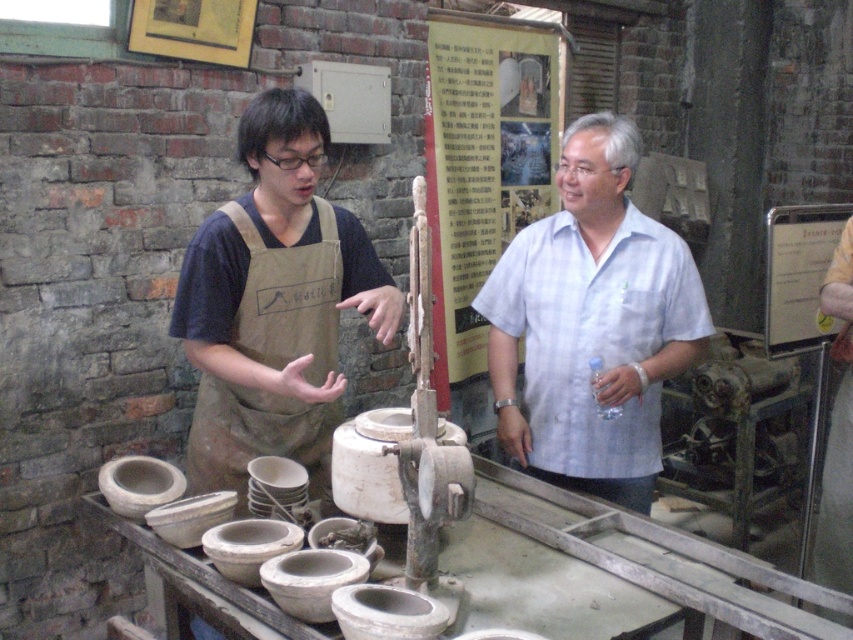
You are a photographer setting up a photo shoot in the pottery workshop. You need to ensure that the white cotton shirt at center and the brown canvas apron at left are both visible in the frame. Based on their sizes, which one might require more careful positioning to avoid being cropped out?

The white cotton shirt at center is much taller than the brown canvas apron at left, so it might require more careful positioning to avoid being cropped out due to its greater height.

You are organizing a pottery workshop and need to ensure that the white cotton shirt at center and the brown canvas apron at left can fit side by side on a 1.2 meter wide shelf. Based on their widths, will both items fit together on the shelf?

The white cotton shirt at center might be wider than brown canvas apron at left. Since the total width of both items could exceed 1.2 meters, it is uncertain if they will fit together on the shelf without further information about their exact widths.

Looking at this image, you are a photographer setting up for a photoshoot in the pottery workshop. You need to ensure that the white cotton shirt at center and the brown canvas apron at left are both visible in the frame. Based on their positions, which one is lower in the image?

The white cotton shirt at center is positioned under the brown canvas apron at left, so the white cotton shirt at center is lower in the image.